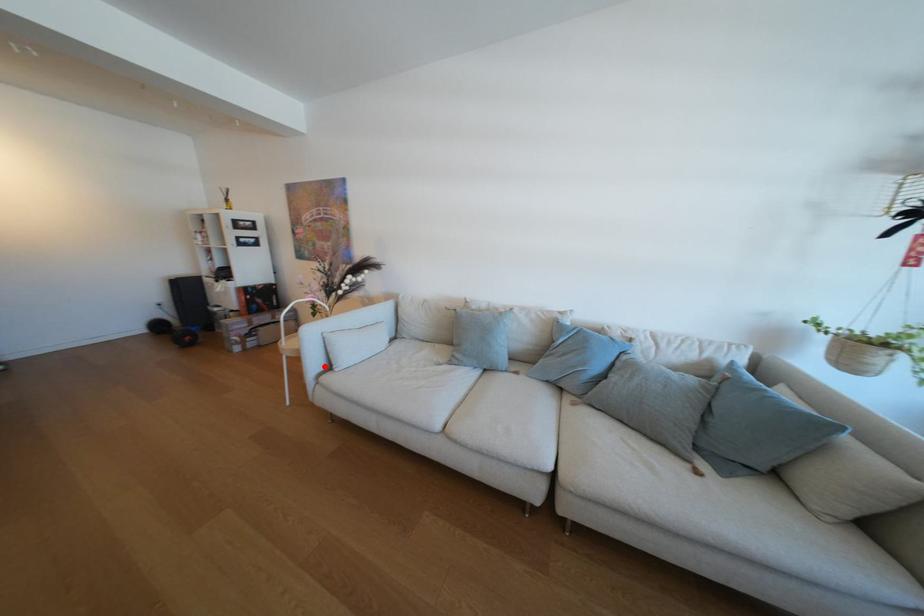
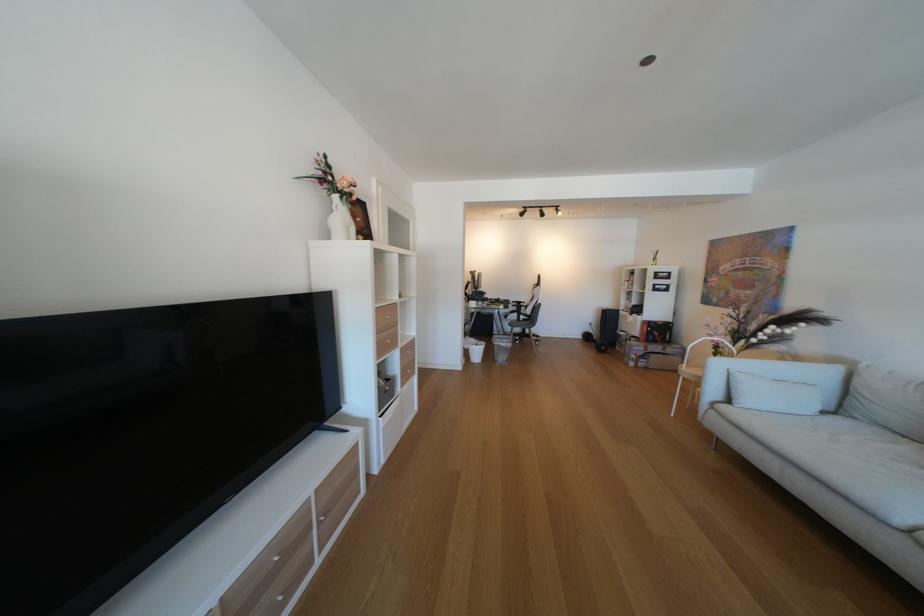
Question: I am providing you with two images of the same scene from different viewpoints. In image1, a red point is highlighted. Considering the same 3D point in image2, which of the following is correct?

Choices:
 (A) It is closer
 (B) It is farther

Answer: (A)